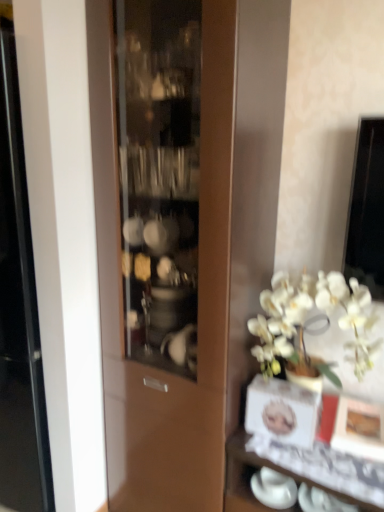
Question: Does white glossy cup at lower right turn towards white glossy vase at lower right?

Choices:
 (A) no
 (B) yes

Answer: (B)

Question: Is white glossy cup at lower right smaller than white glossy vase at lower right?

Choices:
 (A) no
 (B) yes

Answer: (B)

Question: From a real-world perspective, is white glossy cup at lower right beneath white glossy vase at lower right?

Choices:
 (A) yes
 (B) no

Answer: (B)

Question: From a real-world perspective, is white glossy cup at lower right physically above white glossy vase at lower right?

Choices:
 (A) yes
 (B) no

Answer: (A)

Question: Considering the relative positions of white glossy cup at lower right and white glossy vase at lower right in the image provided, is white glossy cup at lower right to the right of white glossy vase at lower right from the viewer's perspective?

Choices:
 (A) no
 (B) yes

Answer: (A)

Question: Considering the relative sizes of white glossy cup at lower right and white glossy vase at lower right in the image provided, is white glossy cup at lower right thinner than white glossy vase at lower right?

Choices:
 (A) yes
 (B) no

Answer: (A)

Question: From the image's perspective, is white glossy vase at lower right located beneath white glossy cup at lower right?

Choices:
 (A) no
 (B) yes

Answer: (B)

Question: Is the position of white glossy vase at lower right more distant than that of white glossy cup at lower right?

Choices:
 (A) yes
 (B) no

Answer: (B)

Question: Is white glossy vase at lower right facing away from white glossy cup at lower right?

Choices:
 (A) yes
 (B) no

Answer: (B)

Question: Is white glossy vase at lower right to the right of white glossy cup at lower right from the viewer's perspective?

Choices:
 (A) yes
 (B) no

Answer: (A)

Question: From a real-world perspective, is white glossy vase at lower right physically above white glossy cup at lower right?

Choices:
 (A) yes
 (B) no

Answer: (B)

Question: Is white glossy cup at lower right a part of white glossy vase at lower right?

Choices:
 (A) no
 (B) yes

Answer: (B)

Question: Is white glossy cup at lower right taller or shorter than white glossy vase at lower right?

Choices:
 (A) short
 (B) tall

Answer: (A)